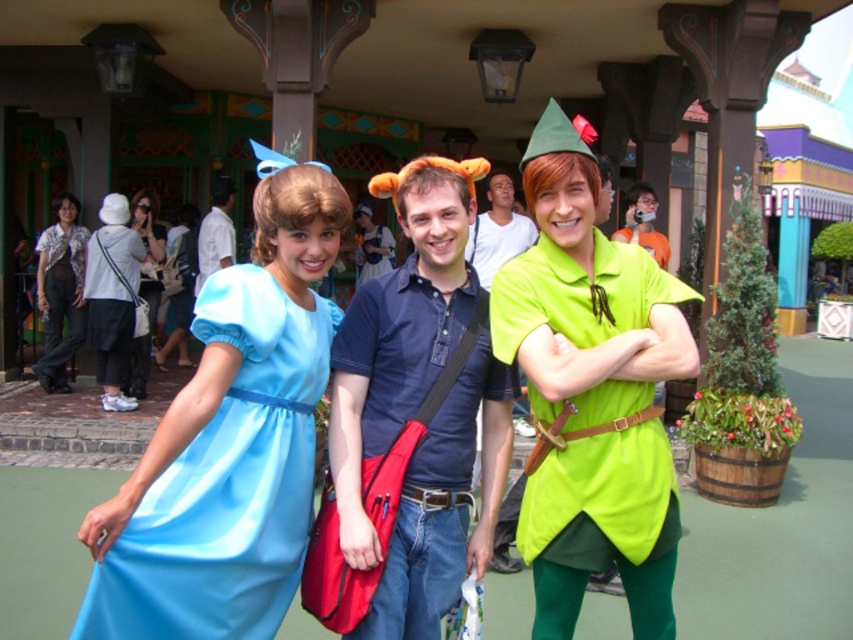
Consider the image. Between dark blue cotton shirt at center and matte white dress at left, which one has more height?

dark blue cotton shirt at center is taller.

Between point (466, 442) and point (146, 365), which one is positioned behind?

Positioned behind is point (146, 365).

Identify the location of dark blue cotton shirt at center. The image size is (853, 640). (419, 406).

Can you confirm if matte white dress at left is positioned to the right of blue cotton shirt at center?

No, matte white dress at left is not to the right of blue cotton shirt at center.

Is point (154, 264) positioned before point (387, 269)?

Yes.

Which is behind, point (146, 291) or point (358, 273)?

The point (358, 273) is behind.

Where is `matte white dress at left`? This screenshot has width=853, height=640. matte white dress at left is located at coordinates (144, 289).

Who is higher up, green matte shirt at center or blue cotton shirt at center?

blue cotton shirt at center is above.

Is point (567, 465) positioned before point (357, 282)?

Yes.

This screenshot has height=640, width=853. In order to click on green matte shirt at center in this screenshot , I will do `click(590, 392)`.